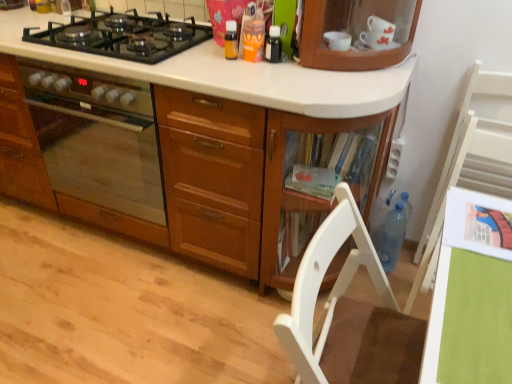
The image size is (512, 384). I want to click on white wood chair at lower right, positioned as the second chair in back-to-front order, so click(x=329, y=295).

The height and width of the screenshot is (384, 512). Describe the element at coordinates (98, 148) in the screenshot. I see `matte wooden oven at left` at that location.

In order to click on translucent plastic bottle at upper center, the third kitchen appliance when ordered from right to left in this screenshot , I will do `click(231, 40)`.

Image resolution: width=512 pixels, height=384 pixels. I want to click on orange plastic cup at upper center, placed as the second kitchen appliance when sorted from left to right, so click(x=253, y=39).

In order to click on green matte table at lower right in this screenshot , I will do `click(469, 303)`.

I want to click on white wood chair at right, which is counted as the 1th chair, starting from the back, so click(x=461, y=131).

Is black glass gas stove at upper left shorter than translucent plastic bottle at upper center, marked as the 1th kitchen appliance in a left-to-right arrangement?

Correct, black glass gas stove at upper left is not as tall as translucent plastic bottle at upper center, marked as the 1th kitchen appliance in a left-to-right arrangement.

Could you measure the distance between black glass gas stove at upper left and translucent plastic bottle at upper center, marked as the 1th kitchen appliance in a left-to-right arrangement?

black glass gas stove at upper left is 18.78 inches from translucent plastic bottle at upper center, marked as the 1th kitchen appliance in a left-to-right arrangement.

Which is more to the right, black glass gas stove at upper left or translucent plastic bottle at upper center, marked as the 1th kitchen appliance in a left-to-right arrangement?

From the viewer's perspective, translucent plastic bottle at upper center, marked as the 1th kitchen appliance in a left-to-right arrangement, appears more on the right side.

From a real-world perspective, is black glass gas stove at upper left located higher than translucent plastic bottle at upper center, marked as the 1th kitchen appliance in a left-to-right arrangement?

Incorrect, from a real-world perspective, black glass gas stove at upper left is lower than translucent plastic bottle at upper center, marked as the 1th kitchen appliance in a left-to-right arrangement.

Are matte wooden oven at left and green matte table at lower right located far from each other?

Indeed, matte wooden oven at left is not near green matte table at lower right.

From a real-world perspective, is matte wooden oven at left located beneath green matte table at lower right?

Yes, from a real-world perspective, matte wooden oven at left is beneath green matte table at lower right.

Is matte wooden oven at left oriented towards green matte table at lower right?

No.

Is blue translucent bottle at lower right far away from white wood chair at lower right, which ranks as the 1th chair in left-to-right order?

Actually, blue translucent bottle at lower right and white wood chair at lower right, which ranks as the 1th chair in left-to-right order, are a little close together.

Is blue translucent bottle at lower right bigger or smaller than white wood chair at lower right, positioned as the second chair in back-to-front order?

blue translucent bottle at lower right is smaller than white wood chair at lower right, positioned as the second chair in back-to-front order.

Is blue translucent bottle at lower right in front of or behind white wood chair at lower right, acting as the 1th chair starting from the front, in the image?

Clearly, blue translucent bottle at lower right is behind white wood chair at lower right, acting as the 1th chair starting from the front.

Is blue translucent bottle at lower right not within white wood chair at lower right, positioned as the second chair in back-to-front order?

Yes, blue translucent bottle at lower right is located beyond the bounds of white wood chair at lower right, positioned as the second chair in back-to-front order.

Which object is thinner, black glass bottle at upper center, which ranks as the 3th kitchen appliance in left-to-right order, or matte wooden oven at left?

black glass bottle at upper center, which ranks as the 3th kitchen appliance in left-to-right order, is thinner.

Locate an element on the screen. This screenshot has width=512, height=384. the 1st kitchen appliance behind the matte wooden oven at left is located at coordinates (273, 45).

From a real-world perspective, between black glass bottle at upper center, the first kitchen appliance in the right-to-left sequence, and matte wooden oven at left, who is vertically lower?

In real-world perspective, matte wooden oven at left is lower.

Is matte wooden oven at left turned away from white wood chair at lower right, which ranks as the 1th chair in left-to-right order?

No, white wood chair at lower right, which ranks as the 1th chair in left-to-right order, is not at the back of matte wooden oven at left.

In the image, is matte wooden oven at left on the left side or the right side of white wood chair at lower right, acting as the 1th chair starting from the front?

From the image, it's evident that matte wooden oven at left is to the left of white wood chair at lower right, acting as the 1th chair starting from the front.

At what (x,y) coordinates should I click in order to perform the action: click on the 2nd chair located beneath the matte wooden oven at left (from a real-world perspective). Please return your answer as a coordinate pair (x, y). This screenshot has width=512, height=384. Looking at the image, I should click on (329, 295).

Is blue translucent bottle at lower right positioned far away from translucent plastic bottle at upper center, the third kitchen appliance when ordered from right to left?

No, blue translucent bottle at lower right is in close proximity to translucent plastic bottle at upper center, the third kitchen appliance when ordered from right to left.

Does blue translucent bottle at lower right turn towards translucent plastic bottle at upper center, the third kitchen appliance when ordered from right to left?

No, blue translucent bottle at lower right is not facing towards translucent plastic bottle at upper center, the third kitchen appliance when ordered from right to left.

Is point (406, 217) closer to camera compared to point (228, 48)?

That is False.

Is blue translucent bottle at lower right not inside translucent plastic bottle at upper center, marked as the 1th kitchen appliance in a left-to-right arrangement?

blue translucent bottle at lower right lies outside translucent plastic bottle at upper center, marked as the 1th kitchen appliance in a left-to-right arrangement,'s area.

Which object is wider, green matte table at lower right or orange plastic cup at upper center, placed as the second kitchen appliance when sorted from left to right?

Wider between the two is green matte table at lower right.

Is green matte table at lower right next to orange plastic cup at upper center, placed as the second kitchen appliance when sorted from left to right, and touching it?

green matte table at lower right and orange plastic cup at upper center, placed as the second kitchen appliance when sorted from left to right, are clearly separated.

Considering the relative positions of green matte table at lower right and orange plastic cup at upper center, placed as the second kitchen appliance when sorted from left to right, in the image provided, is green matte table at lower right in front of orange plastic cup at upper center, placed as the second kitchen appliance when sorted from left to right,?

Yes, green matte table at lower right is in front of orange plastic cup at upper center, placed as the second kitchen appliance when sorted from left to right.

Which is in front, point (482, 301) or point (261, 58)?

Positioned in front is point (482, 301).

From a real-world perspective, which kitchen appliance is the 3rd one above the black glass gas stove at upper left? Please provide its 2D coordinates.

[(231, 40)]

I want to click on home appliance behind the green matte table at lower right, so click(98, 148).

Which object lies nearer to the anchor point white wood chair at lower right, acting as the 1th chair starting from the front, blue translucent bottle at lower right or green matte table at lower right?

Based on the image, green matte table at lower right appears to be nearer to white wood chair at lower right, acting as the 1th chair starting from the front.

Based on their spatial positions, is white wood chair at lower right, which ranks as the 1th chair in left-to-right order, or matte wooden oven at left closer to orange plastic cup at upper center, placed as the second kitchen appliance when sorted from left to right?

Among the two, matte wooden oven at left is located nearer to orange plastic cup at upper center, placed as the second kitchen appliance when sorted from left to right.

Considering their positions, is black glass bottle at upper center, the first kitchen appliance in the right-to-left sequence, positioned further to black glass gas stove at upper left than white wood chair at right, the 2th chair when ordered from front to back?

white wood chair at right, the 2th chair when ordered from front to back.

From the image, which object appears to be nearer to translucent plastic bottle at upper center, the third kitchen appliance when ordered from right to left, blue translucent bottle at lower right or black glass gas stove at upper left?

black glass gas stove at upper left is positioned closer to the anchor translucent plastic bottle at upper center, the third kitchen appliance when ordered from right to left.

When comparing their distances from green matte table at lower right, does black glass gas stove at upper left or white wood chair at right, the 2th chair when ordered from front to back, seem closer?

white wood chair at right, the 2th chair when ordered from front to back, is closer to green matte table at lower right.

Estimate the real-world distances between objects in this image. Which object is closer to black glass gas stove at upper left, translucent plastic bottle at upper center, the third kitchen appliance when ordered from right to left, or white wood chair at right, the 2th chair when ordered from front to back?

Based on the image, translucent plastic bottle at upper center, the third kitchen appliance when ordered from right to left, appears to be nearer to black glass gas stove at upper left.

Based on their spatial positions, is white wood chair at lower right, positioned as the second chair in back-to-front order, or green matte table at lower right closer to black glass bottle at upper center, the first kitchen appliance in the right-to-left sequence?

white wood chair at lower right, positioned as the second chair in back-to-front order, lies closer to black glass bottle at upper center, the first kitchen appliance in the right-to-left sequence, than the other object.

From the image, which object appears to be nearer to black glass gas stove at upper left, white wood chair at lower right, the 2th chair positioned from the right, or green matte table at lower right?

Among the two, white wood chair at lower right, the 2th chair positioned from the right, is located nearer to black glass gas stove at upper left.

Locate an element on the screen. The image size is (512, 384). chair positioned between green matte table at lower right and blue translucent bottle at lower right from near to far is located at coordinates [x=461, y=131].

The width and height of the screenshot is (512, 384). In order to click on kitchen appliance that lies between orange plastic cup at upper center, placed as the second kitchen appliance when sorted from left to right, and blue translucent bottle at lower right from top to bottom in this screenshot , I will do `click(273, 45)`.

Where is `gas stove situated between matte wooden oven at left and blue translucent bottle at lower right from left to right`? gas stove situated between matte wooden oven at left and blue translucent bottle at lower right from left to right is located at coordinates (124, 36).

This screenshot has height=384, width=512. I want to click on gas stove between matte wooden oven at left and green matte table at lower right, so click(124, 36).